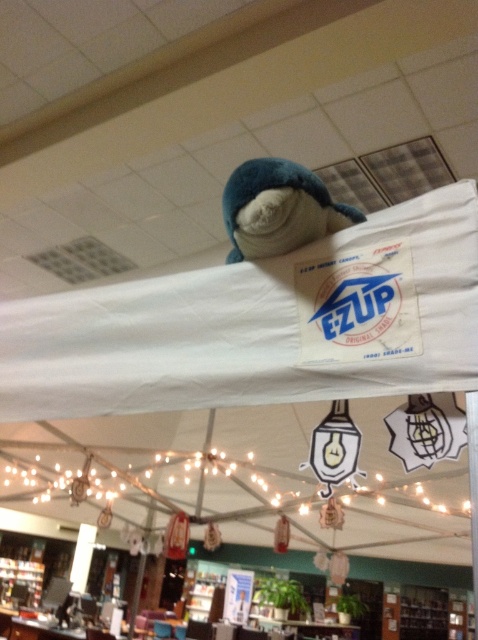
Between white fabric canopy at upper center and soft blue plush at upper center, which one is positioned higher?

Positioned higher is soft blue plush at upper center.

Is point (67, 362) positioned after point (271, 192)?

Yes, point (67, 362) is behind point (271, 192).

At what (x,y) coordinates should I click in order to perform the action: click on white fabric canopy at upper center. Please return your answer as a coordinate pair (x, y). Looking at the image, I should click on (261, 324).